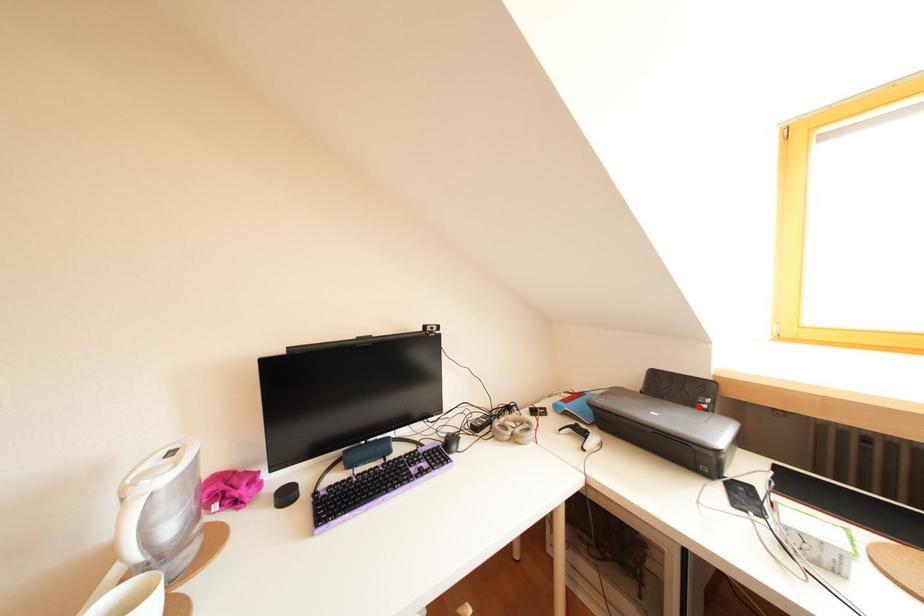
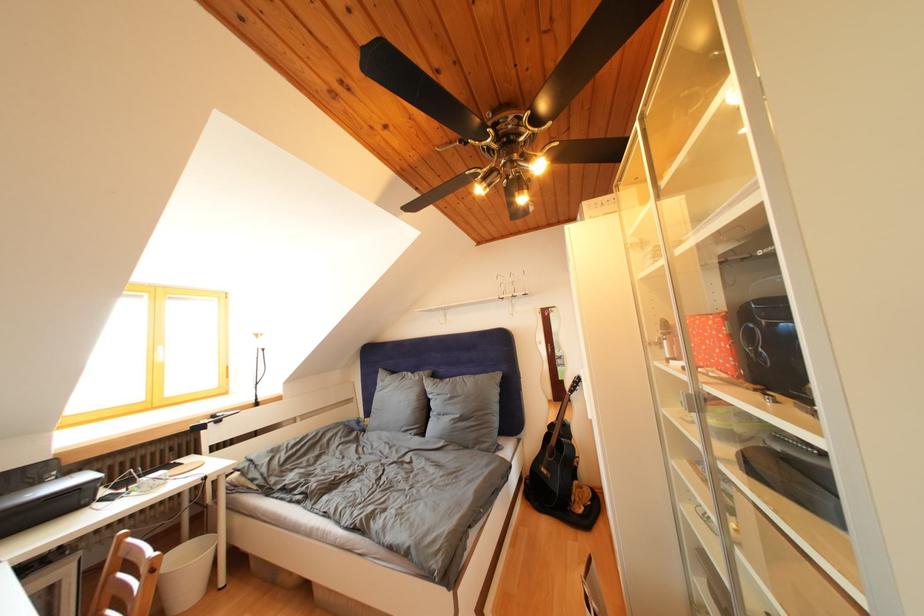
Where in the second image is the point corresponding to the highlighted location from the first image?

(44, 488)